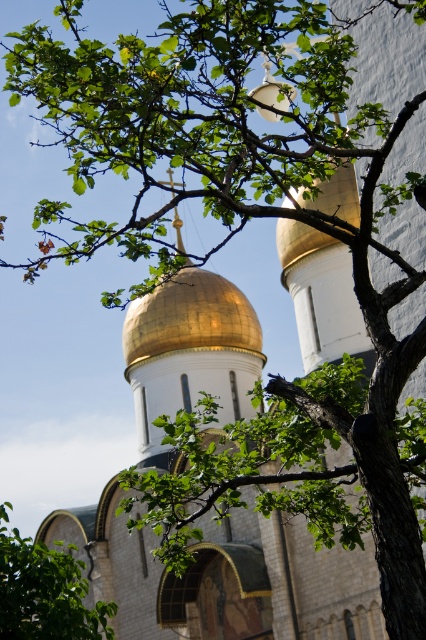
You are standing in front of the grand structure and notice the gold polished dome at center and the green leafy branch at lower left. From your perspective, which object is positioned to the right side?

The gold polished dome at center is positioned to the right of the green leafy branch at lower left.

You are standing at the base of the grand structure and want to take a photo of the gold polished dome at center without the green leafy branch at lower left blocking the view. Given that your camera has a zoom lens capable of focusing up to 30 meters, can you capture a clear shot of the dome without the branch obstructing it?

The distance between the gold polished dome at center and the green leafy branch at lower left is 28.15 meters. Since your camera can focus up to 30 meters, you can zoom in and capture a clear shot of the gold polished dome at center without the green leafy branch at lower left blocking the view.